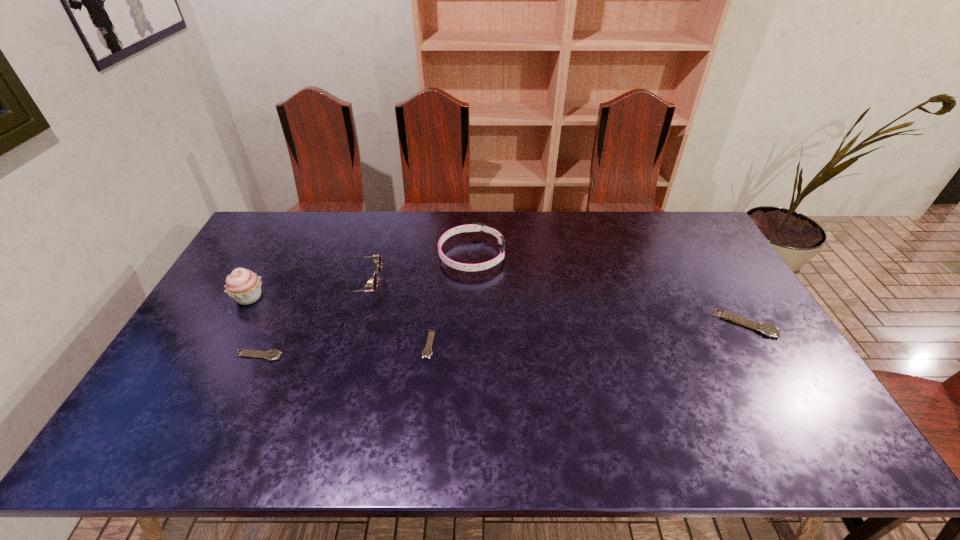
Where is `vacant space located 0.400m on the back of the second shortest watch`? Image resolution: width=960 pixels, height=540 pixels. vacant space located 0.400m on the back of the second shortest watch is located at coordinates (304, 258).

Where is `vacant space located 0.330m on the back of the shortest object`? vacant space located 0.330m on the back of the shortest object is located at coordinates [x=438, y=258].

Identify the location of free spot located 0.390m on the back of the tallest watch. (691, 232).

This screenshot has width=960, height=540. In order to click on free spot located with the buckle on the fourth shortest object in this screenshot , I will do `click(565, 255)`.

Identify the location of vacant space located on the front lenses of the sunglasses. This screenshot has width=960, height=540. (443, 285).

At what (x,y) coordinates should I click in order to perform the action: click on vacant region located on the front of the cupcake. Please return your answer as a coordinate pair (x, y). Looking at the image, I should click on tap(210, 367).

Locate an element on the screen. The height and width of the screenshot is (540, 960). object that is at the far edge is located at coordinates (475, 226).

The width and height of the screenshot is (960, 540). What are the coordinates of `watch located in the left edge section of the desktop` in the screenshot? It's located at tap(271, 355).

Where is `cupcake at the left edge`? cupcake at the left edge is located at coordinates (244, 286).

Find the location of `object situated at the right edge`. object situated at the right edge is located at coordinates (767, 329).